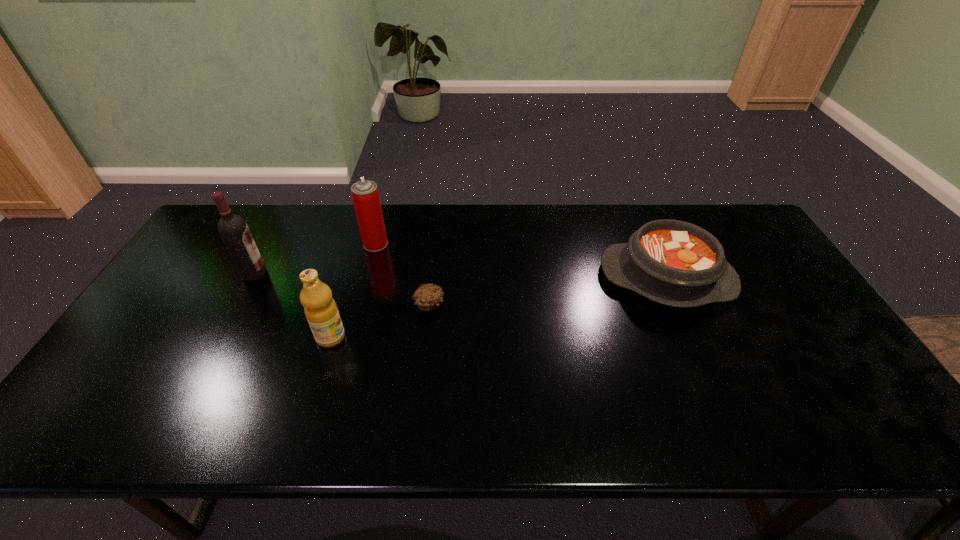
You are a GUI agent. You are given a task and a screenshot of the screen. Output one action in this format:
    pyautogui.click(x=<x>, y=<y>)
    Task: Click on the vacant space that satisfies the following two spatial constraints: 1. on the label of the leftmost object; 2. on the back side of the second object from right to left
    The image size is (960, 540).
    Given the screenshot: What is the action you would take?
    pyautogui.click(x=238, y=305)

Locate an element on the screen. The height and width of the screenshot is (540, 960). vacant space that satisfies the following two spatial constraints: 1. on the front side of the fourth tallest object; 2. on the left side of the aerosol can is located at coordinates (367, 278).

Where is `vacant space that satisfies the following two spatial constraints: 1. on the label of the fourth tallest object; 2. on the left side of the wine bottle`? The height and width of the screenshot is (540, 960). vacant space that satisfies the following two spatial constraints: 1. on the label of the fourth tallest object; 2. on the left side of the wine bottle is located at coordinates (252, 278).

This screenshot has width=960, height=540. Identify the location of vacant space that satisfies the following two spatial constraints: 1. on the label of the wine bottle; 2. on the back side of the fourth object from left to right. (238, 305).

Find the location of a particular element. free space that satisfies the following two spatial constraints: 1. on the label of the wine bottle; 2. on the back side of the muffin is located at coordinates (238, 305).

Locate an element on the screen. free space that satisfies the following two spatial constraints: 1. on the front side of the aerosol can; 2. on the right side of the second shortest object is located at coordinates pos(367,278).